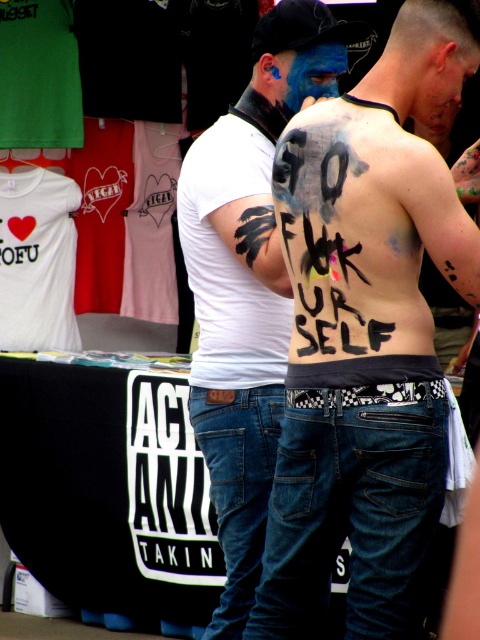
Question: Can you confirm if black matte skin at center is positioned below denim jeans at center?

Choices:
 (A) no
 (B) yes

Answer: (A)

Question: Which object is positioned closest to the white matte shirt at center?

Choices:
 (A) black paint text at back
 (B) denim jeans at center
 (C) black matte skin at center

Answer: (A)

Question: Which point appears farthest from the camera in this image?

Choices:
 (A) (278, 602)
 (B) (230, 252)
 (C) (237, 234)
 (D) (292, 556)

Answer: (B)

Question: Can you confirm if white matte shirt at center is positioned below black matte feather at upper left?

Choices:
 (A) yes
 (B) no

Answer: (A)

Question: Does black matte skin at center appear over black paint text at back?

Choices:
 (A) no
 (B) yes

Answer: (A)

Question: Which point appears farthest from the camera in this image?

Choices:
 (A) (220, 598)
 (B) (309, 349)

Answer: (A)